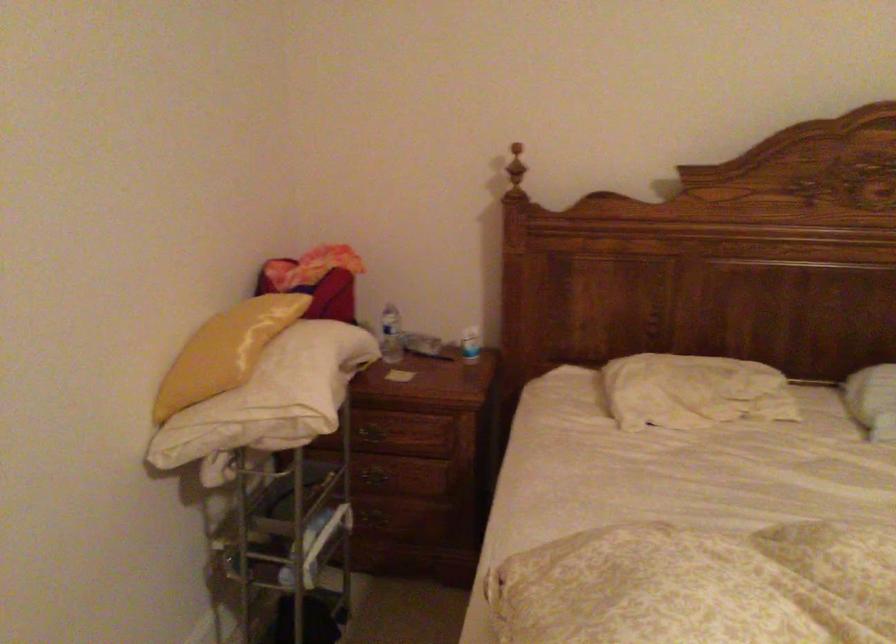
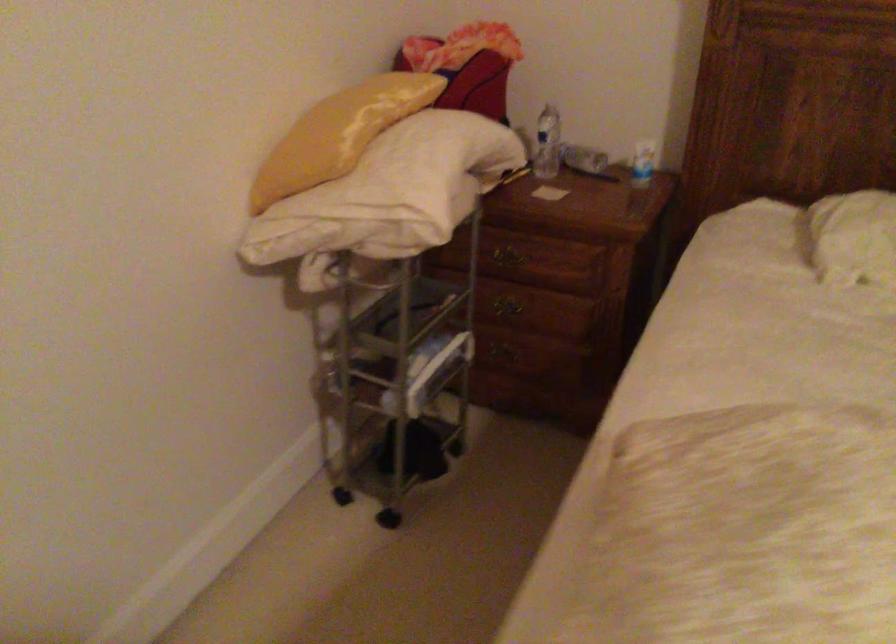
Question: How did the camera likely rotate?

Choices:
 (A) Left
 (B) Right
 (C) Up
 (D) Down

Answer: (D)